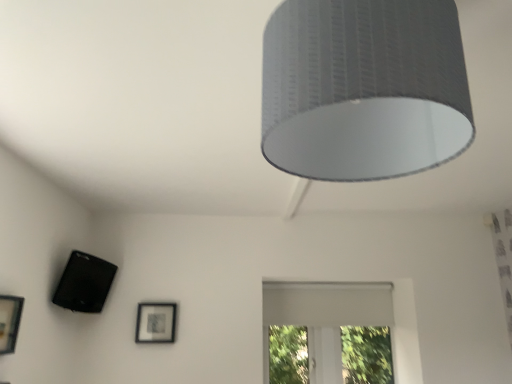
Question: Is matte black picture frame at lower center, positioned as the 1th picture frame in right-to-left order, facing away from white matte window at center?

Choices:
 (A) yes
 (B) no

Answer: (B)

Question: Does matte black picture frame at lower center, which ranks as the second picture frame in top-to-bottom order, appear on the right side of white matte window at center?

Choices:
 (A) yes
 (B) no

Answer: (B)

Question: Is matte black picture frame at lower center, which appears as the first picture frame when viewed from the back, far away from white matte window at center?

Choices:
 (A) no
 (B) yes

Answer: (B)

Question: Does matte black picture frame at lower center, positioned as the 1th picture frame in right-to-left order, have a greater width compared to white matte window at center?

Choices:
 (A) no
 (B) yes

Answer: (A)

Question: From the image's perspective, is matte black picture frame at lower center, positioned as the 1th picture frame in right-to-left order, located beneath white matte window at center?

Choices:
 (A) no
 (B) yes

Answer: (A)

Question: Considering their positions, is matte black picture frame at lower center, placed as the first picture frame when sorted from bottom to top, located in front of or behind textured gray lampshade at upper center?

Choices:
 (A) front
 (B) behind

Answer: (B)

Question: Is matte black picture frame at lower center, which appears as the first picture frame when viewed from the back, spatially inside textured gray lampshade at upper center, or outside of it?

Choices:
 (A) inside
 (B) outside

Answer: (B)

Question: In terms of size, does matte black picture frame at lower center, positioned as the 1th picture frame in right-to-left order, appear bigger or smaller than textured gray lampshade at upper center?

Choices:
 (A) big
 (B) small

Answer: (B)

Question: Based on their positions, is matte black picture frame at lower center, which appears as the first picture frame when viewed from the back, located to the left or right of textured gray lampshade at upper center?

Choices:
 (A) left
 (B) right

Answer: (A)

Question: In terms of width, does textured gray lampshade at upper center look wider or thinner when compared to matte black picture frame at lower center, which ranks as the second picture frame in top-to-bottom order?

Choices:
 (A) thin
 (B) wide

Answer: (B)

Question: Is textured gray lampshade at upper center inside the boundaries of matte black picture frame at lower center, which ranks as the second picture frame in top-to-bottom order, or outside?

Choices:
 (A) outside
 (B) inside

Answer: (A)

Question: In the image, is textured gray lampshade at upper center on the left side or the right side of matte black picture frame at lower center, which appears as the first picture frame when viewed from the back?

Choices:
 (A) right
 (B) left

Answer: (A)

Question: From the image's perspective, relative to matte black picture frame at lower center, which ranks as the second picture frame in top-to-bottom order, is textured gray lampshade at upper center above or below?

Choices:
 (A) above
 (B) below

Answer: (A)

Question: Is matte black picture frame at lower center, which is the second picture frame from left to right, taller or shorter than white matte window at center?

Choices:
 (A) short
 (B) tall

Answer: (A)

Question: Looking at their shapes, would you say matte black picture frame at lower center, placed as the first picture frame when sorted from bottom to top, is wider or thinner than white matte window at center?

Choices:
 (A) thin
 (B) wide

Answer: (A)